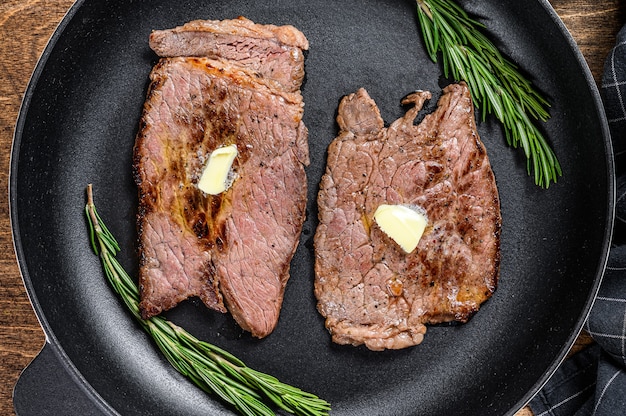
Find the location of `black plate`. black plate is located at coordinates (100, 98).